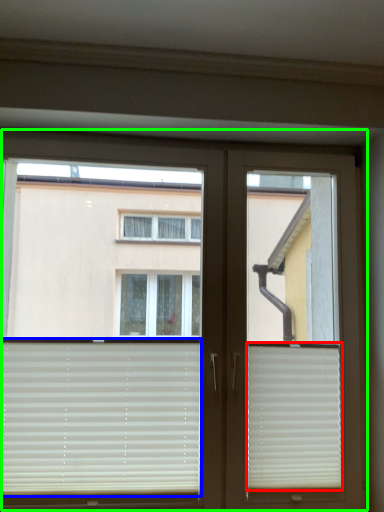
Question: Estimate the real-world distances between objects in this image. Which object is closer to window blind (highlighted by a red box), window blind (highlighted by a blue box) or window (highlighted by a green box)?

Choices:
 (A) window blind
 (B) window

Answer: (B)